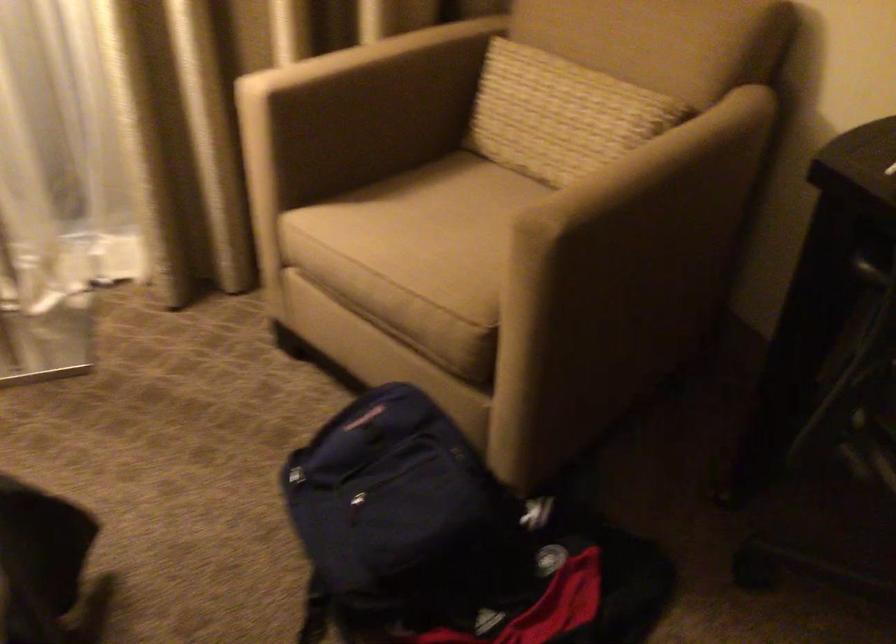
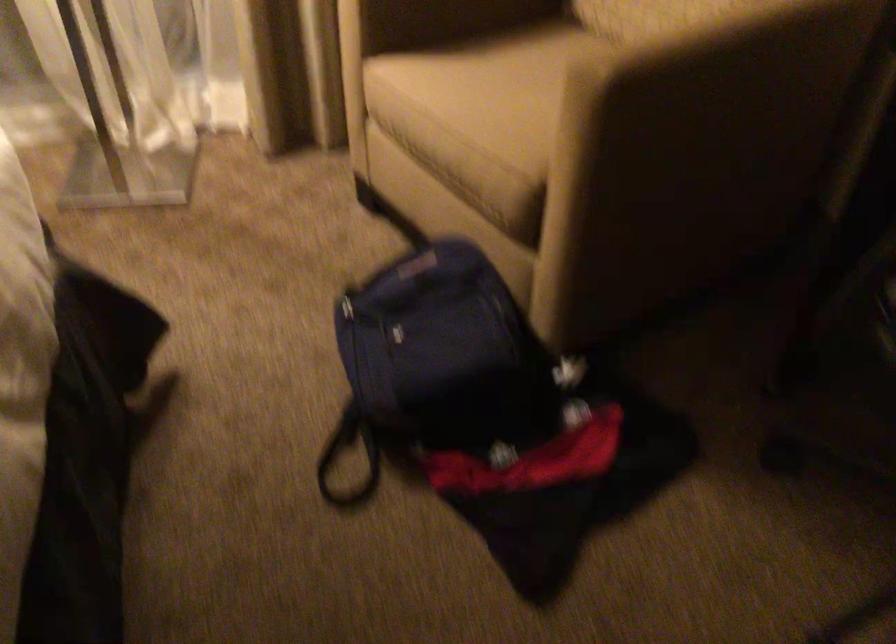
Locate, in the second image, the point that corresponds to (563,207) in the first image.

(617, 53)